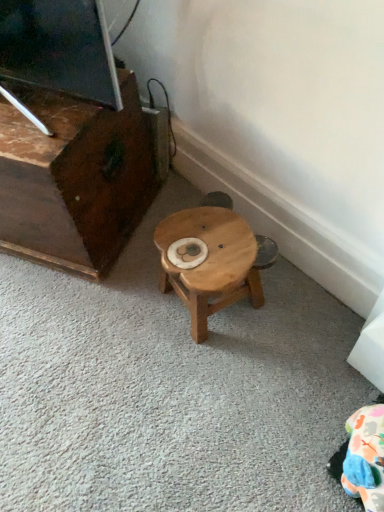
Locate an element on the screen. free point above wooden stool at center (from a real-world perspective) is located at coordinates (x=207, y=245).